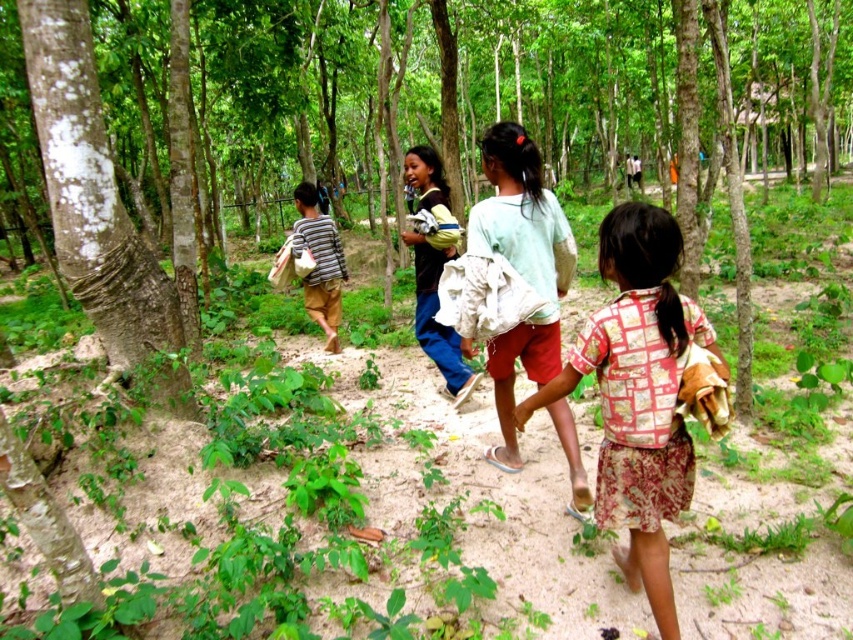
Does green rough bark tree at center have a lesser height compared to light blue jeans at center?

No.

Which is more to the left, green rough bark tree at center or light blue jeans at center?

From the viewer's perspective, light blue jeans at center appears more on the left side.

The width and height of the screenshot is (853, 640). What are the coordinates of `green rough bark tree at center` in the screenshot? It's located at (515, 93).

Is printed cotton shirt at center shorter than striped fabric shirt at center?

Yes.

Does printed cotton shirt at center appear under striped fabric shirt at center?

Yes, printed cotton shirt at center is below striped fabric shirt at center.

Identify the location of printed cotton shirt at center. (637, 394).

Where is `printed cotton shirt at center`? This screenshot has width=853, height=640. printed cotton shirt at center is located at coordinates (637, 394).

Which is behind, point (241, 147) or point (505, 164)?

The point (241, 147) is more distant.

Can you confirm if green rough bark tree at center is thinner than light green fabric at center?

Incorrect, green rough bark tree at center's width is not less than light green fabric at center's.

Does point (689, 188) lie behind point (552, 259)?

Yes.

Locate an element on the screen. This screenshot has width=853, height=640. green rough bark tree at center is located at coordinates (515, 93).